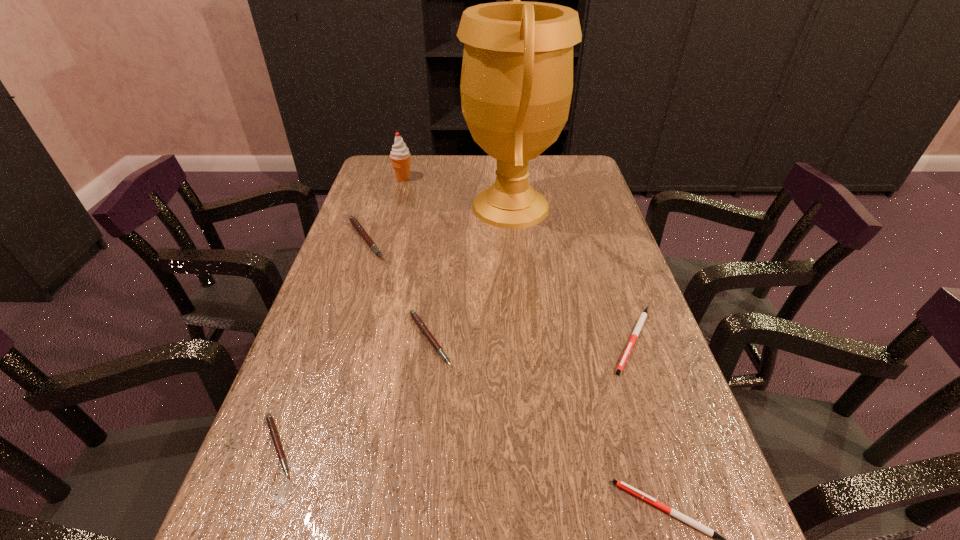
The width and height of the screenshot is (960, 540). I want to click on free space between the nearest pink pen and the rightmost pink pen, so click(x=353, y=393).

The height and width of the screenshot is (540, 960). I want to click on empty space between the smallest pink pen and the trophy, so click(395, 326).

Identify the location of empty location between the bigger white pen and the biggest pink pen. (499, 289).

Find the location of `empty location between the tallest pen and the nearest pink pen`. empty location between the tallest pen and the nearest pink pen is located at coordinates (322, 342).

At what (x,y) coordinates should I click in order to perform the action: click on vacant region between the farther white pen and the sixth shortest object. Please return your answer as a coordinate pair (x, y). The image size is (960, 540). Looking at the image, I should click on (517, 259).

Where is `object that is the fourth nearest to the nearer white pen`? object that is the fourth nearest to the nearer white pen is located at coordinates coord(516,86).

Identify the location of object that stands as the third closest to the nearer white pen. This screenshot has height=540, width=960. (271, 425).

Identify which pen is the third nearest to the bigger white pen. Please provide its 2D coordinates. Your answer should be formatted as a tuple, i.e. [(x, y)], where the tuple contains the x and y coordinates of a point satisfying the conditions above.

[(353, 220)]

Identify the location of pen that is the third closest to the smaller white pen. (271, 425).

The image size is (960, 540). I want to click on pink pen that is the nearest to the fourth farthest pen, so click(413, 314).